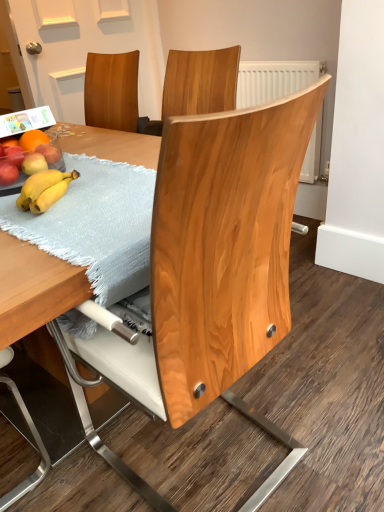
Where is `vacant area that lies in front of yellow matte apple at left, arranged as the second apple when viewed from the front`? vacant area that lies in front of yellow matte apple at left, arranged as the second apple when viewed from the front is located at coordinates coord(44,202).